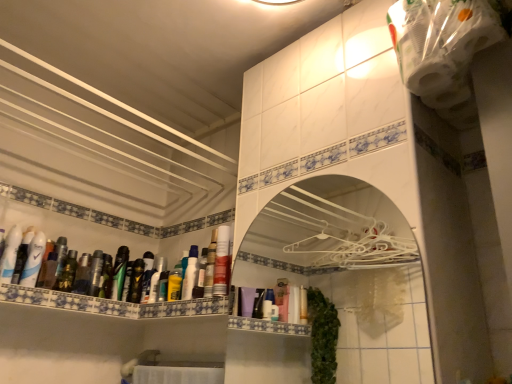
Question: Does green matte mouthwash at left, which is the 3th mouthwash in left-to-right order, have a lesser width compared to white glossy medicine cabinet at center?

Choices:
 (A) yes
 (B) no

Answer: (B)

Question: Considering the relative positions of green matte mouthwash at left, which ranks as the 10th mouthwash in right-to-left order, and white glossy medicine cabinet at center in the image provided, is green matte mouthwash at left, which ranks as the 10th mouthwash in right-to-left order, to the left of white glossy medicine cabinet at center from the viewer's perspective?

Choices:
 (A) no
 (B) yes

Answer: (B)

Question: Is green matte mouthwash at left, which ranks as the 10th mouthwash in right-to-left order, facing away from white glossy medicine cabinet at center?

Choices:
 (A) no
 (B) yes

Answer: (A)

Question: From a real-world perspective, is green matte mouthwash at left, which ranks as the 10th mouthwash in right-to-left order, physically below white glossy medicine cabinet at center?

Choices:
 (A) yes
 (B) no

Answer: (B)

Question: Is green matte mouthwash at left, which ranks as the 10th mouthwash in right-to-left order, positioned before white glossy medicine cabinet at center?

Choices:
 (A) no
 (B) yes

Answer: (A)

Question: From the image's perspective, is matte black tube at left, positioned as the 3th toiletry in right-to-left order, above or below translucent plastic bottle at center, which is the eleventh mouthwash in left-to-right order?

Choices:
 (A) above
 (B) below

Answer: (A)

Question: From a real-world perspective, is matte black tube at left, positioned as the 3th toiletry in right-to-left order, positioned above or below translucent plastic bottle at center, which appears as the second mouthwash when viewed from the right?

Choices:
 (A) above
 (B) below

Answer: (B)

Question: Is matte black tube at left, positioned as the 3th toiletry in right-to-left order, situated inside translucent plastic bottle at center, which appears as the second mouthwash when viewed from the right, or outside?

Choices:
 (A) inside
 (B) outside

Answer: (B)

Question: Considering their positions, is matte black tube at left, the 3th toiletry positioned from the back, located in front of or behind translucent plastic bottle at center, which appears as the second mouthwash when viewed from the right?

Choices:
 (A) front
 (B) behind

Answer: (B)

Question: From the image's perspective, is metallic silver mouthwash at left, which is the sixth mouthwash in right-to-left order, located above or below shiny metallic spray can at left, which is counted as the 2th toiletry, starting from the left?

Choices:
 (A) below
 (B) above

Answer: (A)

Question: In terms of width, does metallic silver mouthwash at left, which is the sixth mouthwash in right-to-left order, look wider or thinner when compared to shiny metallic spray can at left, which is counted as the 2th toiletry, starting from the left?

Choices:
 (A) thin
 (B) wide

Answer: (B)

Question: From a real-world perspective, is metallic silver mouthwash at left, which is the sixth mouthwash in right-to-left order, above or below shiny metallic spray can at left, which ranks as the second toiletry in right-to-left order?

Choices:
 (A) below
 (B) above

Answer: (A)

Question: In terms of size, does metallic silver mouthwash at left, acting as the seventh mouthwash starting from the left, appear bigger or smaller than shiny metallic spray can at left, the second toiletry in the front-to-back sequence?

Choices:
 (A) big
 (B) small

Answer: (B)

Question: In terms of height, does white glossy mouthwash at left, placed as the 12th mouthwash when sorted from right to left, look taller or shorter compared to white glossy mouthwash at upper center, acting as the 12th mouthwash starting from the left?

Choices:
 (A) tall
 (B) short

Answer: (B)

Question: Is point (20, 236) positioned closer to the camera than point (217, 248)?

Choices:
 (A) closer
 (B) farther

Answer: (B)